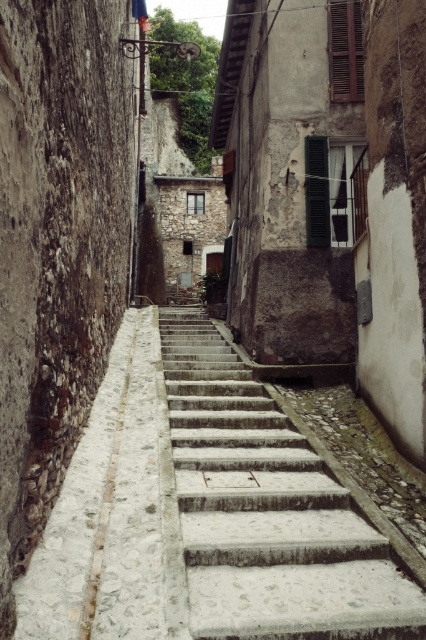
Question: Observing the image, what is the correct spatial positioning of smooth concrete stairs at center in reference to white stone path at center?

Choices:
 (A) left
 (B) right

Answer: (B)

Question: Does smooth concrete stairs at center have a greater width compared to white stone path at center?

Choices:
 (A) yes
 (B) no

Answer: (A)

Question: Which of the following is the closest to the observer?

Choices:
 (A) smooth concrete stairs at center
 (B) white stone path at center

Answer: (B)

Question: Is the position of smooth concrete stairs at center more distant than that of white stone path at center?

Choices:
 (A) yes
 (B) no

Answer: (A)

Question: Which point is closer to the camera taking this photo?

Choices:
 (A) (230, 481)
 (B) (117, 445)

Answer: (A)